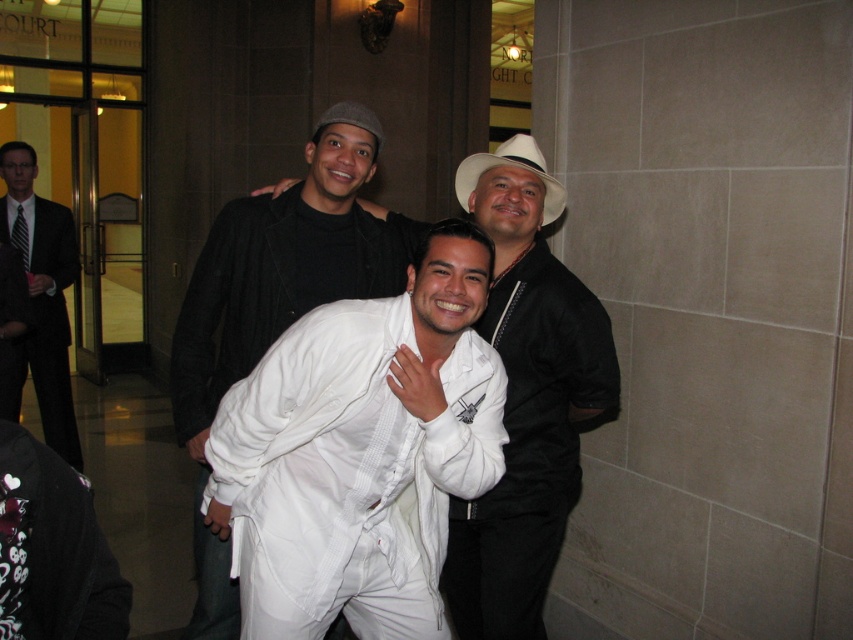
Question: Which point is closer to the camera taking this photo?

Choices:
 (A) (554, 314)
 (B) (508, 145)

Answer: (A)

Question: Where is white satin shirt at center located in relation to white felt cowboy hat at center in the image?

Choices:
 (A) right
 (B) left

Answer: (B)

Question: Which of the following is the closest to the observer?

Choices:
 (A) matte black suit at left
 (B) white matte robe at center

Answer: (B)

Question: Is white matte jacket at center below white felt cowboy hat at center?

Choices:
 (A) no
 (B) yes

Answer: (B)

Question: Is white matte jacket at center in front of white felt cowboy hat at center?

Choices:
 (A) yes
 (B) no

Answer: (A)

Question: Which object appears closest to the camera in this image?

Choices:
 (A) white matte robe at center
 (B) white satin shirt at center
 (C) white felt cowboy hat at center

Answer: (B)